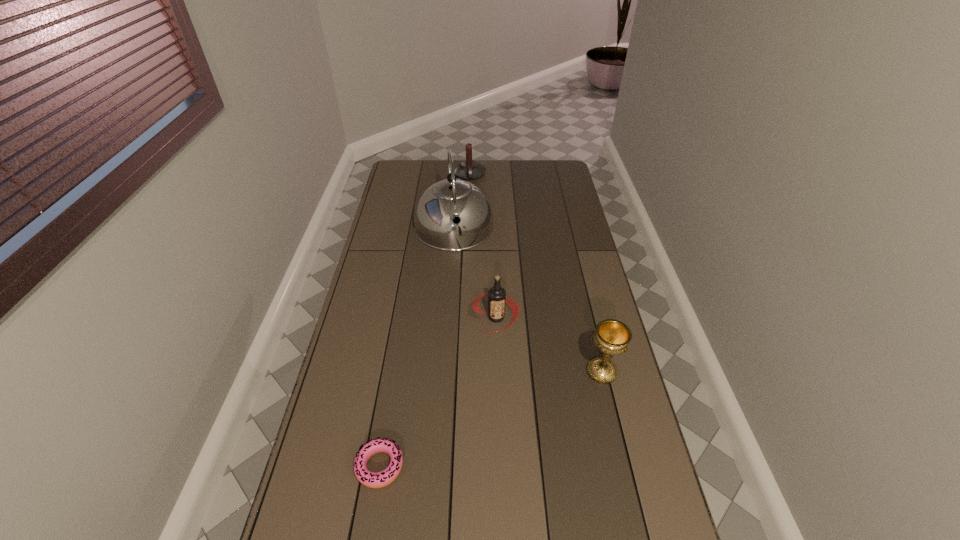
This screenshot has height=540, width=960. I want to click on vacant space on the desktop that is between the nearest object and the fourth farthest object and is positioned on the side of the farthest object with the handle loop, so click(x=495, y=417).

Identify the location of vacant space on the desktop that is between the shortest object and the chalice and is positioned on the label of the root beer. (490, 420).

Where is `vacant space on the desktop that is between the shortest object and the fourth farthest object and is positioned from the spout of the kettle`? vacant space on the desktop that is between the shortest object and the fourth farthest object and is positioned from the spout of the kettle is located at coordinates (481, 423).